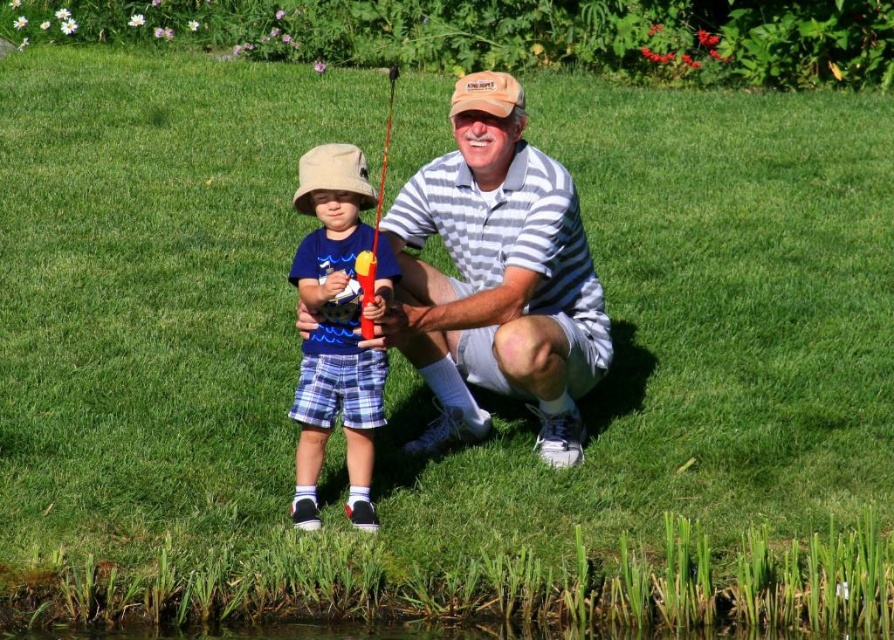
You are a photographer trying to capture the grandfather and grandson in the scene. You notice the white striped polo shirt at center and the tan fabric baseball cap at center. Which item is positioned lower on their bodies?

The white striped polo shirt at center is positioned lower than the tan fabric baseball cap at center on their bodies.

You are a photographer trying to capture a photo of the two subjects in the scene. You notice the white striped polo shirt at center and the tan fabric baseball hat at center. Which object should you focus on first if you want to capture the one that is positioned more to the left?

The tan fabric baseball hat at center is positioned more to the left compared to the white striped polo shirt at center, so you should focus on the tan fabric baseball hat at center first.

You are standing in the middle of the lawn and want to pick up both items located at point [571,429] and point [299,189]. Which point should you visit first to minimize the distance you walk?

You should visit point [299,189] first because it is closer to you than point [571,429], which is further away.